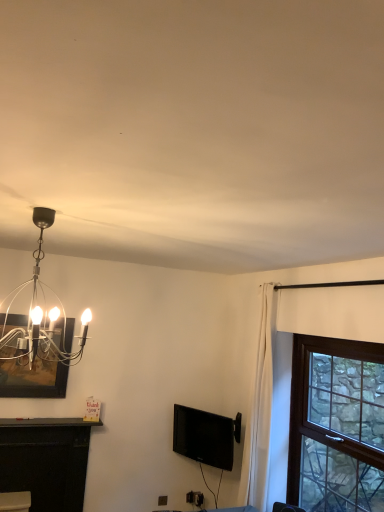
Question: From a real-world perspective, is brown wooden window at right above or below polished silver chandelier at upper left?

Choices:
 (A) below
 (B) above

Answer: (A)

Question: Looking at their shapes, would you say brown wooden window at right is wider or thinner than polished silver chandelier at upper left?

Choices:
 (A) wide
 (B) thin

Answer: (B)

Question: Which of these objects is positioned farthest from the polished silver chandelier at upper left?

Choices:
 (A) matte black picture frame at upper left
 (B) black glossy tv at center
 (C) brown wooden window at right
 (D) black matte fireplace at lower left

Answer: (C)

Question: Which object is positioned farthest from the black matte fireplace at lower left?

Choices:
 (A) brown wooden window at right
 (B) black glossy tv at center
 (C) matte black picture frame at upper left
 (D) polished silver chandelier at upper left

Answer: (A)